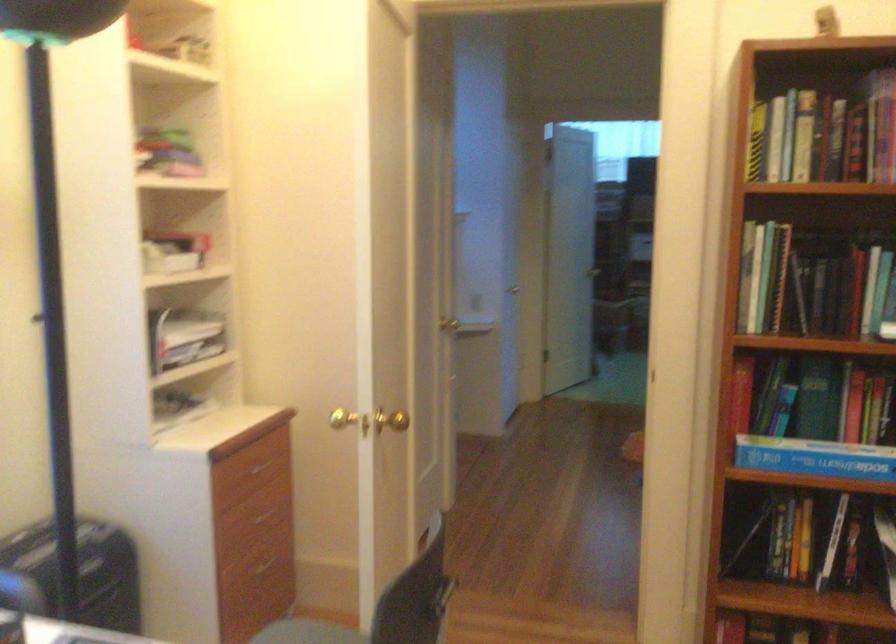
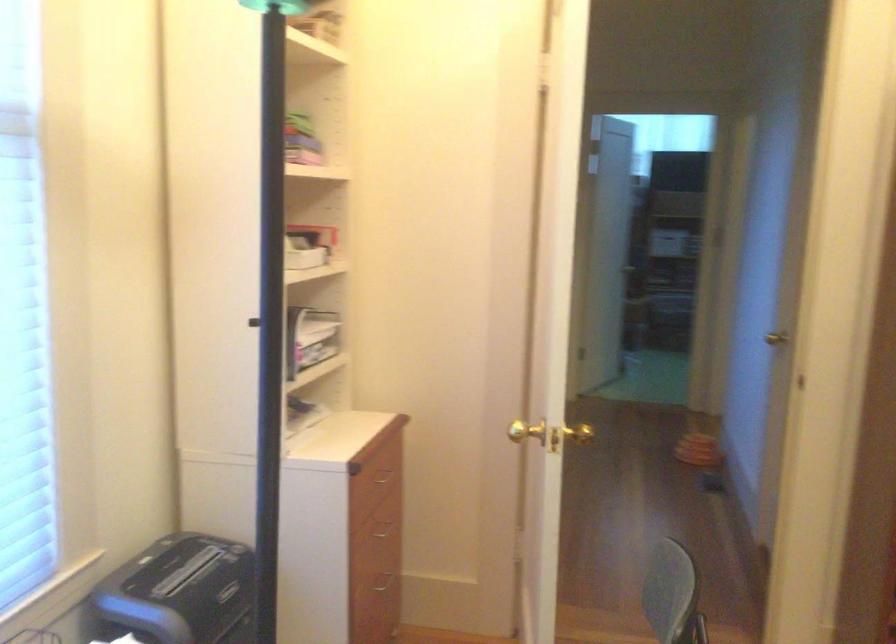
The point at (256, 522) is marked in the first image. Where is the corresponding point in the second image?

(382, 534)